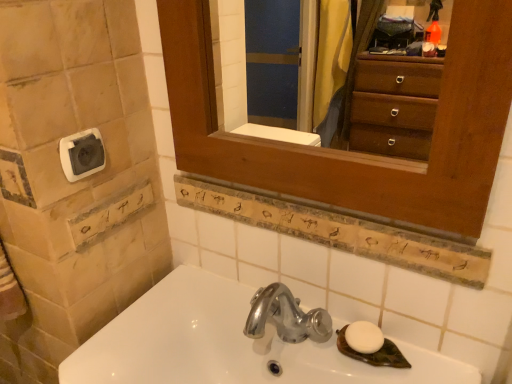
Question: Considering the relative positions of wooden medicine cabinet at upper center and white plastic towel bar at upper left in the image provided, is wooden medicine cabinet at upper center to the left or to the right of white plastic towel bar at upper left?

Choices:
 (A) right
 (B) left

Answer: (A)

Question: From the image's perspective, is wooden medicine cabinet at upper center positioned above or below white plastic towel bar at upper left?

Choices:
 (A) above
 (B) below

Answer: (A)

Question: Considering the real-world distances, which object is closest to the wooden medicine cabinet at upper center?

Choices:
 (A) wooden sign at center
 (B) white matte soap at lower right
 (C) white glossy sink at lower center
 (D) white plastic towel bar at upper left
 (E) white stone tiles at left

Answer: (A)

Question: Which is farther from the wooden sign at center?

Choices:
 (A) white matte soap at lower right
 (B) wooden medicine cabinet at upper center
 (C) white plastic towel bar at upper left
 (D) white glossy sink at lower center
 (E) white stone tiles at left

Answer: (C)